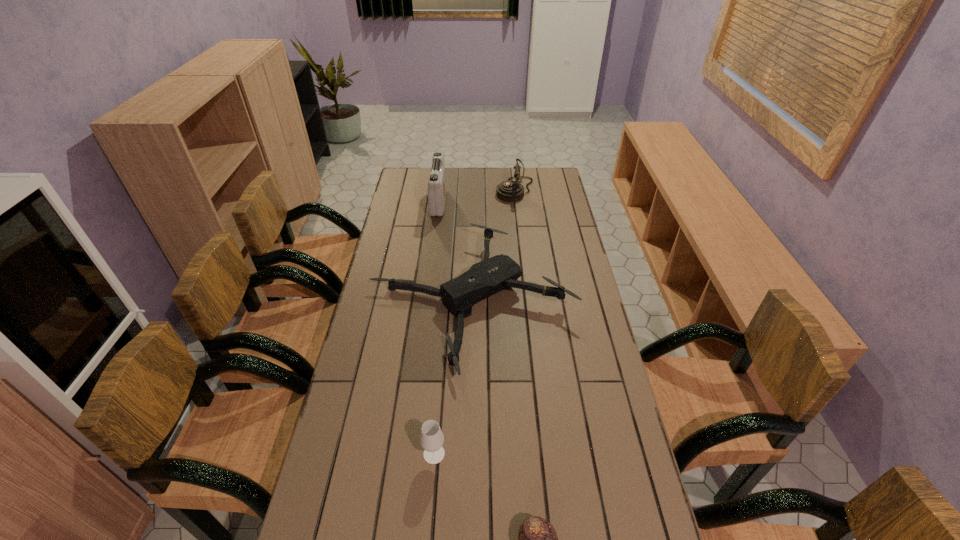
You are a GUI agent. You are given a task and a screenshot of the screen. Output one action in this format:
    pyautogui.click(x=<x>, y=<y>)
    Task: Click on the free space between the first-aid kit and the third nearest object
    The width and height of the screenshot is (960, 540).
    Given the screenshot: What is the action you would take?
    pyautogui.click(x=455, y=253)

In order to click on empty location between the telephone and the drone in this screenshot , I will do click(493, 246).

At what (x,y) coordinates should I click in order to perform the action: click on free space between the first-aid kit and the fourth farthest object. Please return your answer as a coordinate pair (x, y). This screenshot has height=540, width=960. Looking at the image, I should click on (436, 329).

Find the location of `vacant space that is in between the drone and the first-aid kit`. vacant space that is in between the drone and the first-aid kit is located at coordinates (455, 253).

I want to click on blank region between the tallest object and the drone, so click(455, 253).

Identify the location of vacant space that's between the telephone and the tallest object. Image resolution: width=960 pixels, height=540 pixels. (477, 197).

Identify the location of vacant space that's between the third farthest object and the glass. This screenshot has height=540, width=960. (452, 378).

This screenshot has width=960, height=540. I want to click on object that is the third closest to the fourth tallest object, so click(510, 191).

This screenshot has width=960, height=540. I want to click on object that is the closest to the shortest object, so click(x=431, y=439).

This screenshot has width=960, height=540. Find the location of `vacant area in the image that satisfies the following two spatial constraints: 1. on the front side of the first-aid kit; 2. on the back side of the drone`. vacant area in the image that satisfies the following two spatial constraints: 1. on the front side of the first-aid kit; 2. on the back side of the drone is located at coordinates (426, 302).